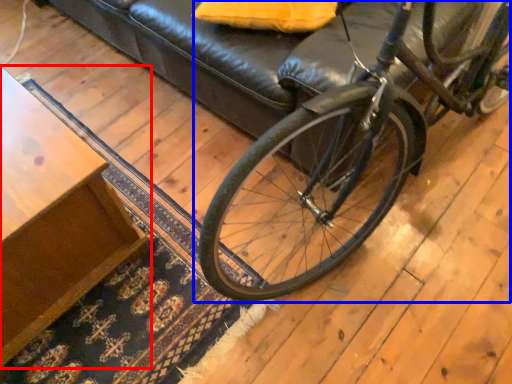
Question: Which of the following is the closest to the observer, table (highlighted by a red box) or bicycle (highlighted by a blue box)?

Choices:
 (A) table
 (B) bicycle

Answer: (B)